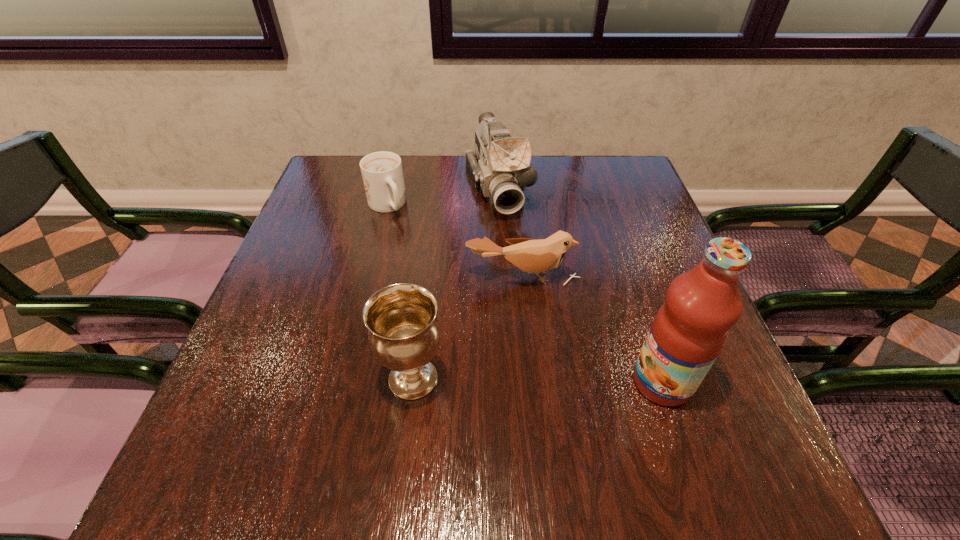
The height and width of the screenshot is (540, 960). I want to click on the fourth object from right to left, so click(404, 333).

The height and width of the screenshot is (540, 960). What are the coordinates of `fruit juice` in the screenshot? It's located at (690, 329).

I want to click on the rightmost object, so click(690, 329).

In order to click on bird in this screenshot , I will do tap(530, 255).

You are a GUI agent. You are given a task and a screenshot of the screen. Output one action in this format:
    pyautogui.click(x=<x>, y=<y>)
    Task: Click on the cappuccino
    The image size is (960, 540).
    Given the screenshot: What is the action you would take?
    coord(382,173)

Find the location of a particular element. The height and width of the screenshot is (540, 960). camcorder is located at coordinates (500, 168).

The height and width of the screenshot is (540, 960). Identify the location of vacant space located 0.140m on the right of the chalice. (522, 379).

This screenshot has height=540, width=960. Identify the location of vacant space situated on the front label of the tallest object. (482, 382).

Identify the location of free region located on the front label of the tallest object. (444, 382).

You are a GUI agent. You are given a task and a screenshot of the screen. Output one action in this format:
    pyautogui.click(x=<x>, y=<y>)
    Task: Click on the free space located on the front label of the tallest object
    The width and height of the screenshot is (960, 540).
    Given the screenshot: What is the action you would take?
    pyautogui.click(x=577, y=382)